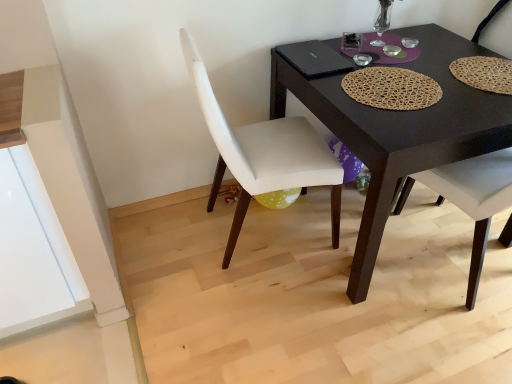
This screenshot has height=384, width=512. Describe the element at coordinates (314, 58) in the screenshot. I see `black matte laptop at upper center` at that location.

Describe the element at coordinates (400, 130) in the screenshot. I see `black matte desk at center` at that location.

The width and height of the screenshot is (512, 384). What are the coordinates of `black matte laptop at upper center` in the screenshot? It's located at click(314, 58).

Is black matte laptop at upper center facing away from matte white chair at right, which appears as the first chair when viewed from the right?

black matte laptop at upper center does not have its back to matte white chair at right, which appears as the first chair when viewed from the right.

How many degrees apart are the facing directions of black matte laptop at upper center and matte white chair at right, which appears as the first chair when viewed from the right?

The facing directions of black matte laptop at upper center and matte white chair at right, which appears as the first chair when viewed from the right, are 95.4 degrees apart.

Considering the sizes of black matte laptop at upper center and matte white chair at right, the second chair when ordered from left to right, in the image, is black matte laptop at upper center taller or shorter than matte white chair at right, the second chair when ordered from left to right,?

Considering their sizes, black matte laptop at upper center has less height than matte white chair at right, the second chair when ordered from left to right.

Consider the image. Considering the relative sizes of black matte laptop at upper center and matte white chair at right, the second chair when ordered from left to right, in the image provided, is black matte laptop at upper center bigger than matte white chair at right, the second chair when ordered from left to right,?

No.

Measure the distance from black matte desk at center to black matte laptop at upper center.

black matte desk at center and black matte laptop at upper center are 13.09 inches apart from each other.

Is black matte desk at center further to the viewer compared to black matte laptop at upper center?

No, black matte desk at center is closer to the viewer.

The image size is (512, 384). What are the coordinates of `laptop on the left of black matte desk at center` in the screenshot? It's located at (314, 58).

Is black matte desk at center outside of matte white chair at right, the second chair when ordered from left to right?

Yes, black matte desk at center is outside of matte white chair at right, the second chair when ordered from left to right.

In the scene shown: Is black matte desk at center wider or thinner than matte white chair at right, which appears as the first chair when viewed from the right?

black matte desk at center is wider than matte white chair at right, which appears as the first chair when viewed from the right.

Based on the photo, would you consider black matte desk at center to be distant from matte white chair at right, which appears as the first chair when viewed from the right?

They are positioned close to each other.

Based on the photo, from a real-world perspective, is black matte desk at center located higher than matte white chair at right, the second chair when ordered from left to right?

No.

Which is farther, (x=315, y=72) or (x=207, y=104)?

Positioned behind is point (x=315, y=72).

Looking at this image, from the image's perspective, which is below, black matte laptop at upper center or white leather chair at center, which is the 1th chair from left to right?

white leather chair at center, which is the 1th chair from left to right, appears lower in the image.

Could you tell me if black matte laptop at upper center is facing white leather chair at center, which is the 1th chair from left to right?

Yes, black matte laptop at upper center is oriented towards white leather chair at center, which is the 1th chair from left to right.

Are black matte laptop at upper center and white leather chair at center, which is the 1th chair from left to right, making contact?

No, black matte laptop at upper center is not making contact with white leather chair at center, which is the 1th chair from left to right.

From a real-world perspective, is matte white chair at right, which appears as the first chair when viewed from the right, below white leather chair at center, which is the 1th chair from left to right?

Indeed, from a real-world perspective, matte white chair at right, which appears as the first chair when viewed from the right, is positioned beneath white leather chair at center, which is the 1th chair from left to right.

Is matte white chair at right, which appears as the first chair when viewed from the right, positioned beyond the bounds of white leather chair at center, which is the 1th chair from left to right?

matte white chair at right, which appears as the first chair when viewed from the right, is positioned outside white leather chair at center, which is the 1th chair from left to right.

At what (x,y) coordinates should I click in order to perform the action: click on chair that is under the white leather chair at center, the second chair positioned from the right (from a real-world perspective). Please return your answer as a coordinate pair (x, y). The height and width of the screenshot is (384, 512). Looking at the image, I should click on (469, 184).

Are matte white chair at right, the second chair when ordered from left to right, and white leather chair at center, the second chair positioned from the right, beside each other?

No, matte white chair at right, the second chair when ordered from left to right, is not making contact with white leather chair at center, the second chair positioned from the right.

Does point (290, 130) come behind point (380, 115)?

That is True.

From the image's perspective, relative to black matte desk at center, is white leather chair at center, the second chair positioned from the right, above or below?

Clearly, from the image's perspective, white leather chair at center, the second chair positioned from the right, is below black matte desk at center.

Can you see white leather chair at center, the second chair positioned from the right, touching black matte desk at center?

No, white leather chair at center, the second chair positioned from the right, is not in contact with black matte desk at center.

Looking at this image, which object is wider, white leather chair at center, the second chair positioned from the right, or black matte desk at center?

Wider between the two is black matte desk at center.

Does white leather chair at center, the second chair positioned from the right, have a greater height compared to black matte laptop at upper center?

Yes, white leather chair at center, the second chair positioned from the right, is taller than black matte laptop at upper center.

Based on the photo, could you tell me if white leather chair at center, the second chair positioned from the right, is turned towards black matte laptop at upper center?

Yes, white leather chair at center, the second chair positioned from the right, is facing black matte laptop at upper center.

Is white leather chair at center, which is the 1th chair from left to right, beside black matte laptop at upper center?

white leather chair at center, which is the 1th chair from left to right, and black matte laptop at upper center are not in contact.

Can you confirm if white leather chair at center, which is the 1th chair from left to right, is wider than black matte laptop at upper center?

Yes.

Identify the location of the 2nd chair located beneath the black matte laptop at upper center (from a real-world perspective). (469, 184).

Image resolution: width=512 pixels, height=384 pixels. I want to click on desk in front of the black matte laptop at upper center, so click(x=400, y=130).

Consider the image. Which object lies further to the anchor point black matte laptop at upper center, matte white chair at right, the second chair when ordered from left to right, or black matte desk at center?

matte white chair at right, the second chair when ordered from left to right, lies further to black matte laptop at upper center than the other object.

Estimate the real-world distances between objects in this image. Which object is closer to black matte desk at center, white leather chair at center, which is the 1th chair from left to right, or matte white chair at right, which appears as the first chair when viewed from the right?

white leather chair at center, which is the 1th chair from left to right.

When comparing their distances from matte white chair at right, which appears as the first chair when viewed from the right, does white leather chair at center, the second chair positioned from the right, or black matte desk at center seem closer?

The object closer to matte white chair at right, which appears as the first chair when viewed from the right, is black matte desk at center.

Consider the image. When comparing their distances from white leather chair at center, the second chair positioned from the right, does black matte desk at center or black matte laptop at upper center seem further?

black matte laptop at upper center.

Considering their positions, is black matte laptop at upper center positioned further to white leather chair at center, the second chair positioned from the right, than matte white chair at right, the second chair when ordered from left to right?

matte white chair at right, the second chair when ordered from left to right.

Which object lies further to the anchor point matte white chair at right, the second chair when ordered from left to right, white leather chair at center, the second chair positioned from the right, or black matte laptop at upper center?

The object further to matte white chair at right, the second chair when ordered from left to right, is black matte laptop at upper center.

When comparing their distances from matte white chair at right, which appears as the first chair when viewed from the right, does black matte desk at center or white leather chair at center, the second chair positioned from the right, seem further?

The object further to matte white chair at right, which appears as the first chair when viewed from the right, is white leather chair at center, the second chair positioned from the right.

Looking at the image, which one is located closer to matte white chair at right, which appears as the first chair when viewed from the right, black matte laptop at upper center or white leather chair at center, which is the 1th chair from left to right?

white leather chair at center, which is the 1th chair from left to right, is closer to matte white chair at right, which appears as the first chair when viewed from the right.

The width and height of the screenshot is (512, 384). Identify the location of desk between black matte laptop at upper center and matte white chair at right, which appears as the first chair when viewed from the right, from left to right. (400, 130).

Where is `desk between white leather chair at center, the second chair positioned from the right, and matte white chair at right, the second chair when ordered from left to right, in the horizontal direction`? desk between white leather chair at center, the second chair positioned from the right, and matte white chair at right, the second chair when ordered from left to right, in the horizontal direction is located at coordinates (400, 130).

This screenshot has height=384, width=512. What are the coordinates of `laptop situated between white leather chair at center, which is the 1th chair from left to right, and matte white chair at right, which appears as the first chair when viewed from the right, from left to right` in the screenshot? It's located at (314, 58).

In order to click on laptop between white leather chair at center, the second chair positioned from the right, and black matte desk at center, in the horizontal direction in this screenshot , I will do `click(314, 58)`.